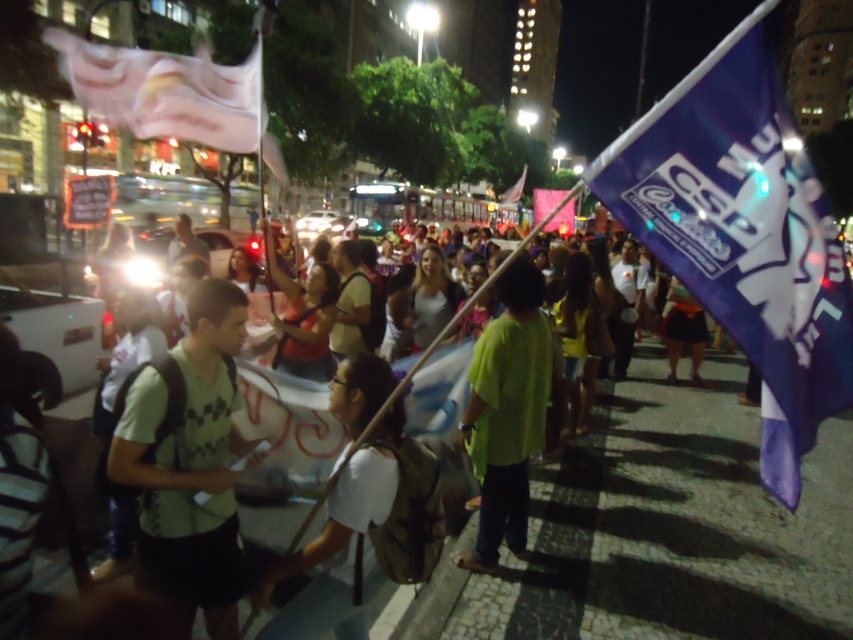
You are a photographer standing on the sidewalk capturing the scene. You notice two people wearing white matte shirt at center and green matte shirt at center. Which shirt is closer to your camera lens?

The white matte shirt at center is closer to the camera lens because it is in front of the green matte shirt at center.

You are standing at the center of the street and looking towards the group of people carrying banners and flags. There is a point marked at coordinates (190, 465). What object is located at that point?

The green checkered shirt at left is located at point (190, 465).